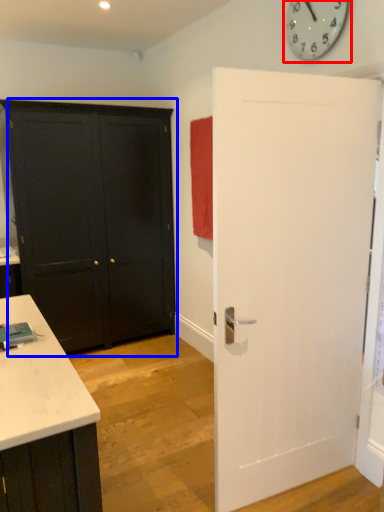
Question: Which point is further to the camera, clock (highlighted by a red box) or door (highlighted by a blue box)?

Choices:
 (A) clock
 (B) door

Answer: (B)